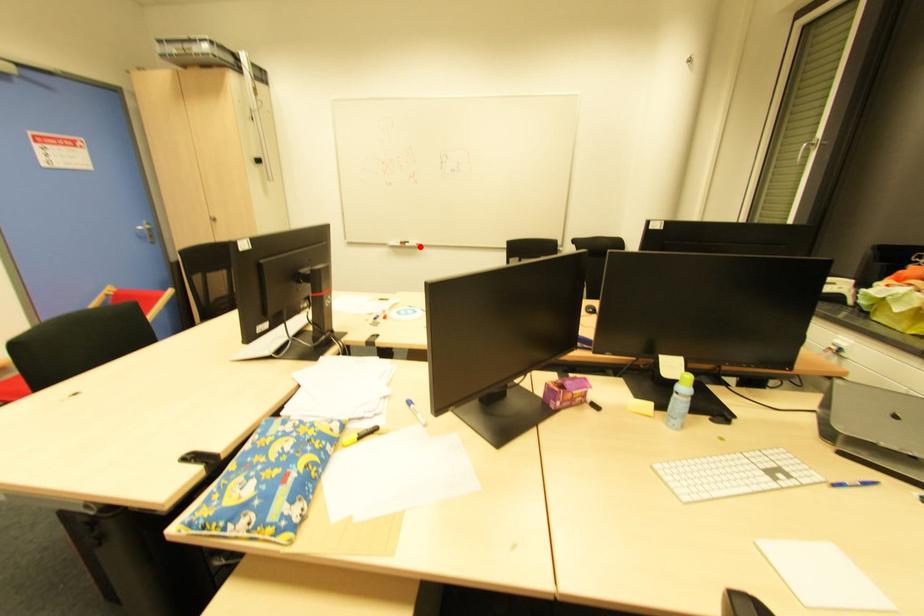
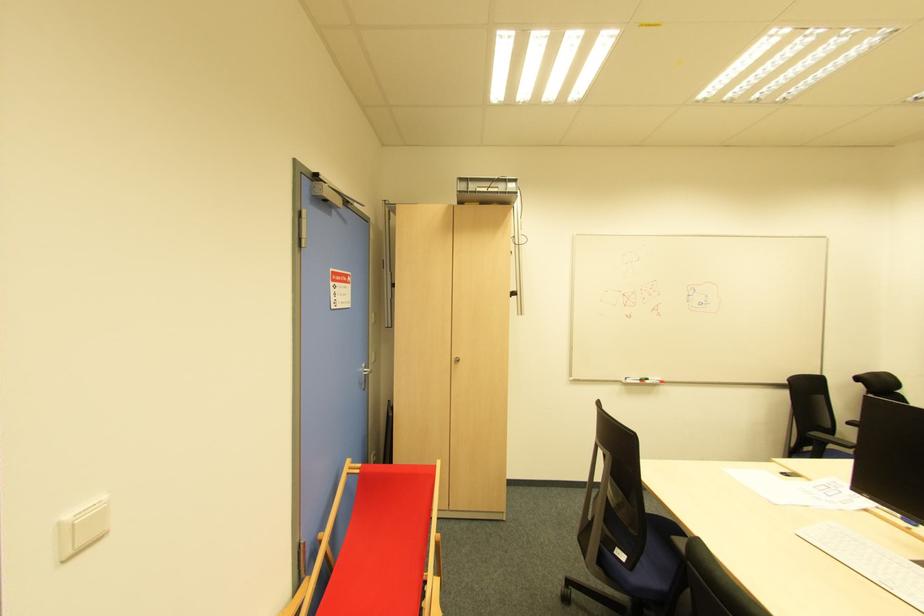
The point at the highlighted location is marked in the first image. Where is the corresponding point in the second image?

(662, 383)